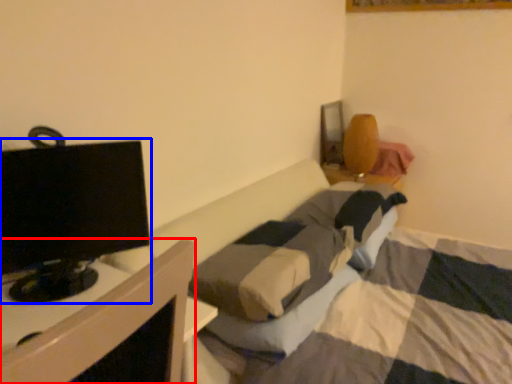
Question: Which point is closer to the camera, furniture (highlighted by a red box) or television (highlighted by a blue box)?

Choices:
 (A) furniture
 (B) television

Answer: (A)